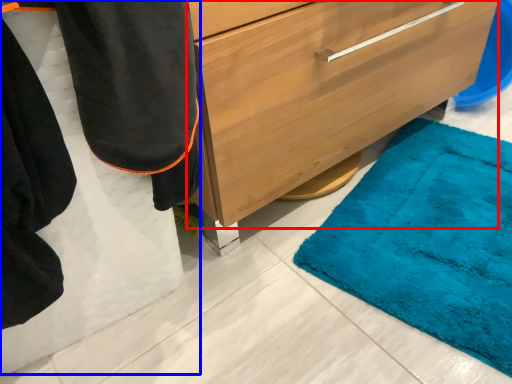
Question: Which point is closer to the camera, chest of drawers (highlighted by a red box) or robe (highlighted by a blue box)?

Choices:
 (A) chest of drawers
 (B) robe

Answer: (B)